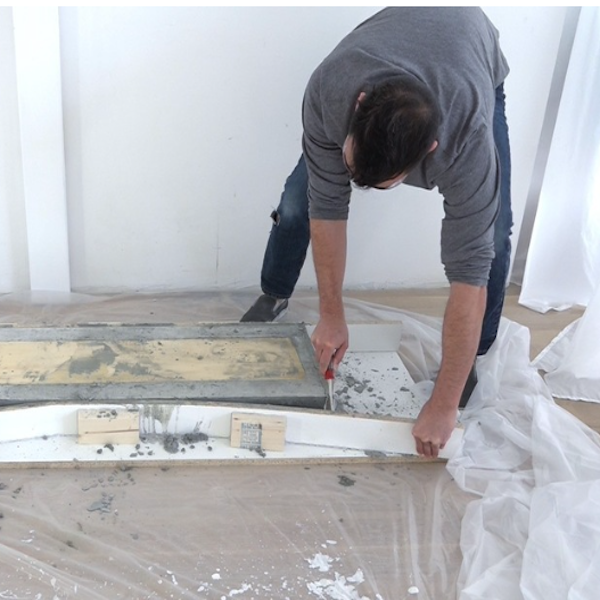
Where is `floor`? floor is located at coordinates (539, 325).